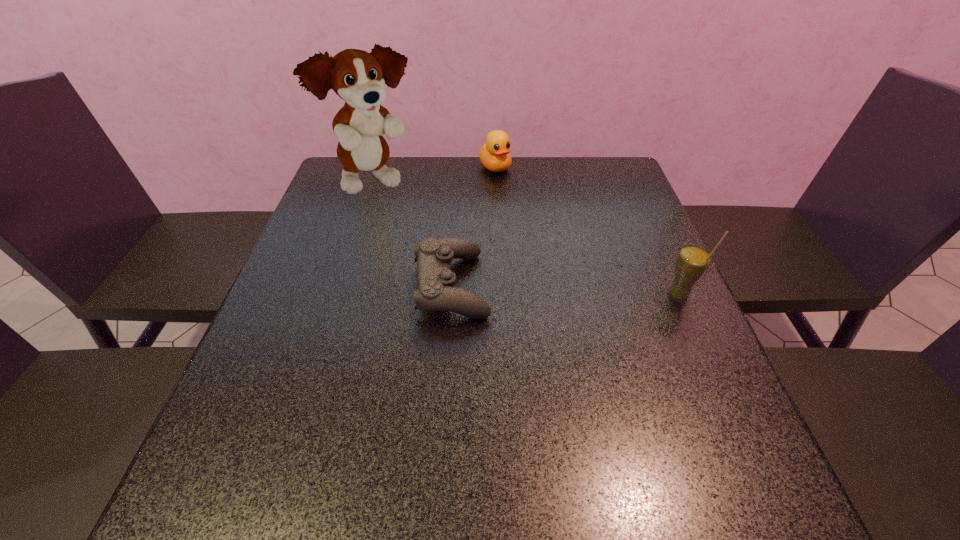
At what (x,y) coordinates should I click in order to perform the action: click on free region located 0.250m on the face of the duckling. Please return your answer as a coordinate pair (x, y). The height and width of the screenshot is (540, 960). Looking at the image, I should click on tap(539, 225).

What are the coordinates of `free spot located on the face of the tallest object` in the screenshot? It's located at coord(496,265).

Where is `vacant space located on the face of the tallest object`? vacant space located on the face of the tallest object is located at coordinates [493, 262].

This screenshot has height=540, width=960. In order to click on free region located 0.400m on the face of the tallest object in this screenshot , I will do 506,271.

The image size is (960, 540). I want to click on duckling at the far edge, so click(x=495, y=155).

You are a GUI agent. You are given a task and a screenshot of the screen. Output one action in this format:
    pyautogui.click(x=<x>, y=<y>)
    Task: Click on the puppy present at the far edge
    The height and width of the screenshot is (540, 960).
    Given the screenshot: What is the action you would take?
    pyautogui.click(x=358, y=77)

At what (x,y) coordinates should I click in order to perform the action: click on object at the left edge. Please return your answer as a coordinate pair (x, y). This screenshot has height=540, width=960. Looking at the image, I should click on (358, 77).

In order to click on object that is positioned at the right edge in this screenshot , I will do pos(693,260).

The height and width of the screenshot is (540, 960). Find the location of `object at the far left corner`. object at the far left corner is located at coordinates (358, 77).

Find the location of `free space at the far edge of the desktop`. free space at the far edge of the desktop is located at coordinates (394, 158).